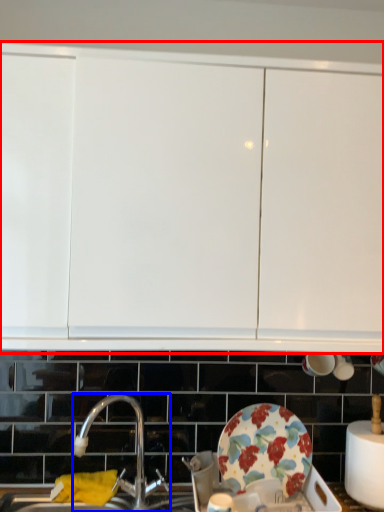
Question: Among these objects, which one is farthest to the camera, cabinetry (highlighted by a red box) or tap (highlighted by a blue box)?

Choices:
 (A) cabinetry
 (B) tap

Answer: (B)